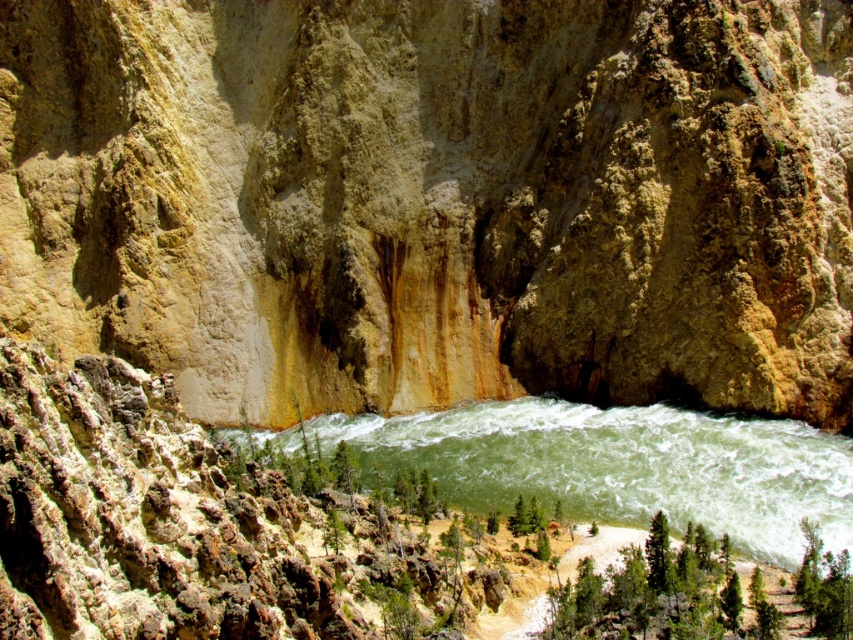
Question: Does green smooth water at center have a lesser width compared to green leafy tree at lower center?

Choices:
 (A) no
 (B) yes

Answer: (A)

Question: Which point appears closest to the camera in this image?

Choices:
 (A) (508, 516)
 (B) (628, 406)

Answer: (A)

Question: Which point is closer to the camera?

Choices:
 (A) green leafy tree at lower center
 (B) green smooth water at center

Answer: (B)

Question: Is green smooth water at center below green leafy tree at lower center?

Choices:
 (A) yes
 (B) no

Answer: (B)

Question: Does green smooth water at center have a smaller size compared to green leafy tree at lower center?

Choices:
 (A) no
 (B) yes

Answer: (A)